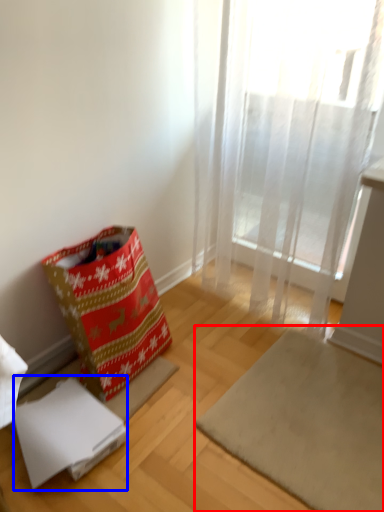
Question: Among these objects, which one is farthest to the camera, mat (highlighted by a red box) or cardboard box (highlighted by a blue box)?

Choices:
 (A) mat
 (B) cardboard box

Answer: (B)